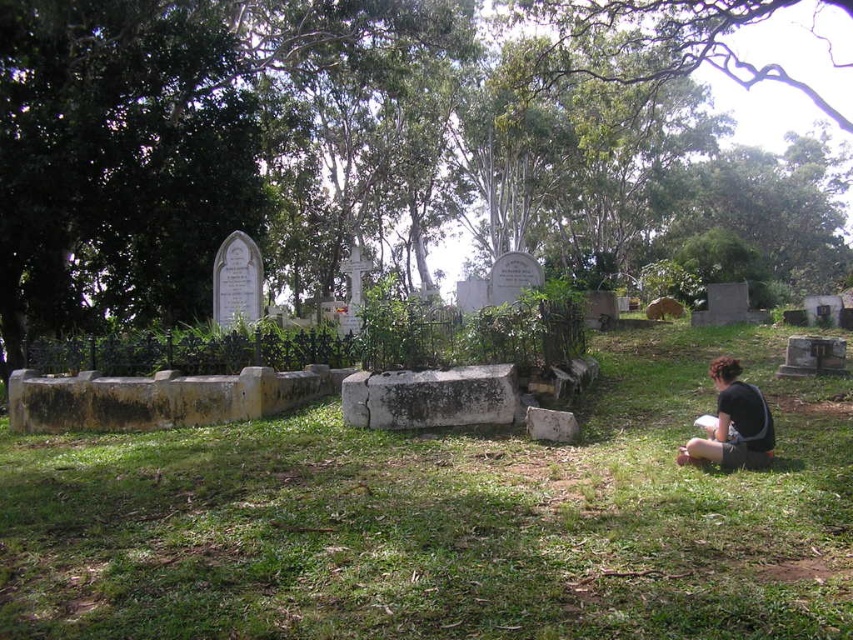
Can you confirm if green grassy at center is positioned to the right of black fabric squat at lower right?

No, green grassy at center is not to the right of black fabric squat at lower right.

Is green grassy at center above black fabric squat at lower right?

No.

Find the location of a particular element. green grassy at center is located at coordinates (445, 520).

What are the coordinates of `green grassy at center` in the screenshot? It's located at (445, 520).

Between green leafy tree at center and green grassy at center, which one has less height?

green grassy at center

Is green leafy tree at center in front of green grassy at center?

No, green leafy tree at center is further to the viewer.

Does point (312, 278) come closer to viewer compared to point (671, 593)?

No, it is behind (671, 593).

Where is `green leafy tree at center`? The width and height of the screenshot is (853, 640). green leafy tree at center is located at coordinates (380, 148).

Is green leafy tree at center to the left of black fabric squat at lower right from the viewer's perspective?

In fact, green leafy tree at center is to the right of black fabric squat at lower right.

Is point (84, 147) positioned in front of point (741, 451)?

No.

The image size is (853, 640). I want to click on green leafy tree at center, so click(380, 148).